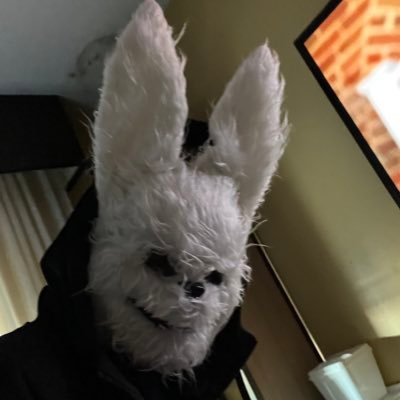
Where is `bucket`? bucket is located at coordinates (356, 376).